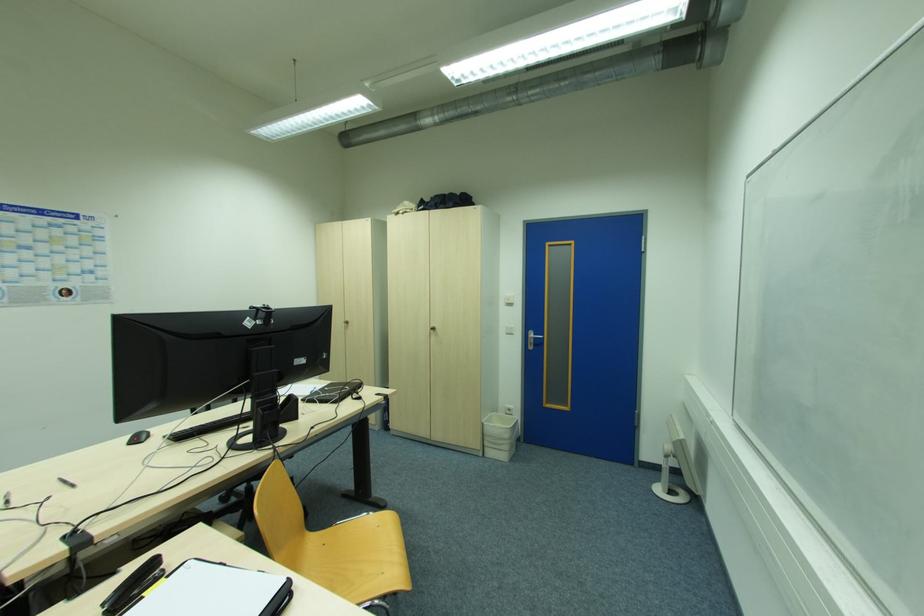
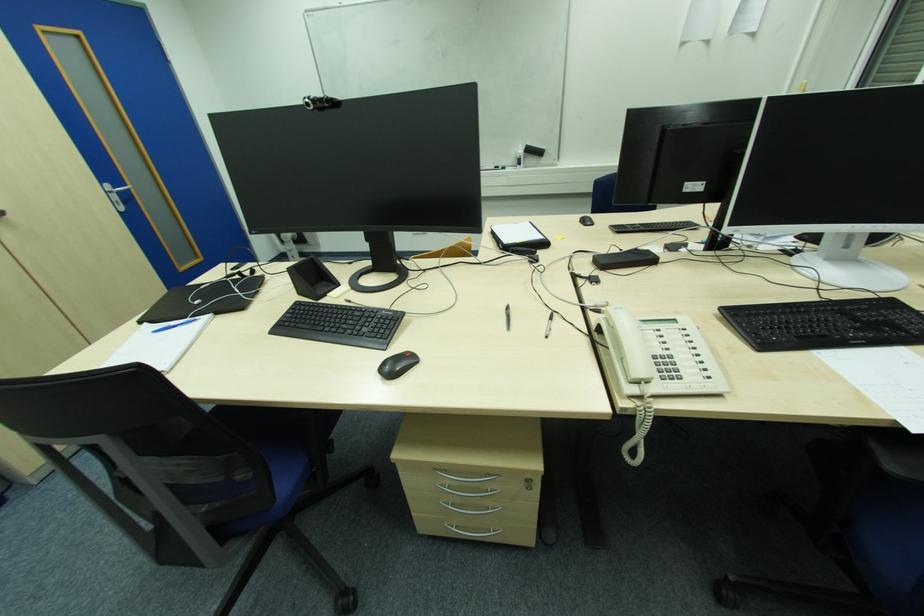
Where in the second image is the point corresponding to point 76,487 from the first image?

(509, 309)